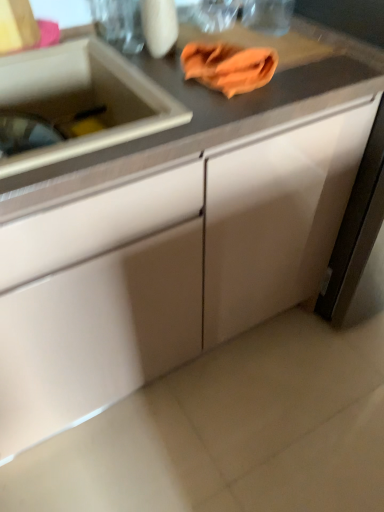
Locate an element on the screen. vacant space underneath orange cloth at upper center (from a real-world perspective) is located at coordinates (220, 84).